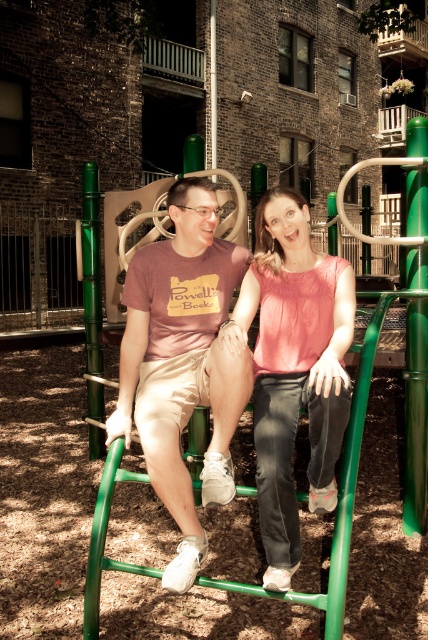
From the picture: You are standing at the origin of the coordinate system in the playground scene. You want to place a small sticker exactly at the point marked by the coordinates point (x=183, y=362). What object will the sticker land on?

The sticker will land on the matte pink t shirt at center marked by the coordinates point (x=183, y=362).